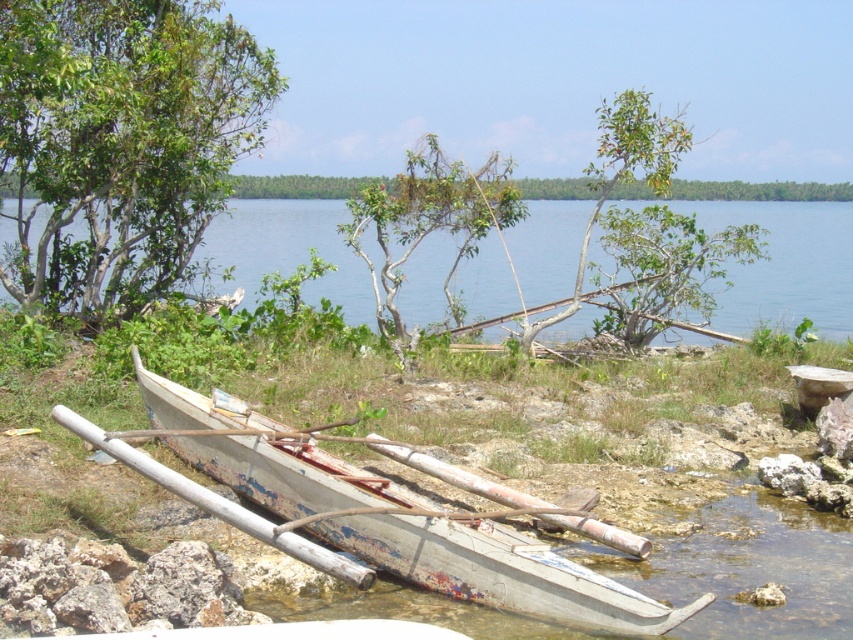
You are standing on the rocky shoreline and want to take a photo of the white wooden boat at lower center and the green leafy tree at center. Which object should you focus on first if you want to capture both in the same frame without moving your camera?

You should focus on the white wooden boat at lower center first because it is closer to you than the green leafy tree at center, allowing both to be in the same frame without moving the camera.

You are standing on the rocky shoreline and notice the blue water at center and the white wooden boat at lower center. Which one appears taller from your perspective?

The blue water at center appears taller than the white wooden boat at lower center from your perspective.

You are standing on the rocky shoreline and see the blue water at center and the white wooden boat at lower center. Which object is higher in position from your viewpoint?

The blue water at center is above the white wooden boat at lower center, so the blue water at center is higher in position from your viewpoint.